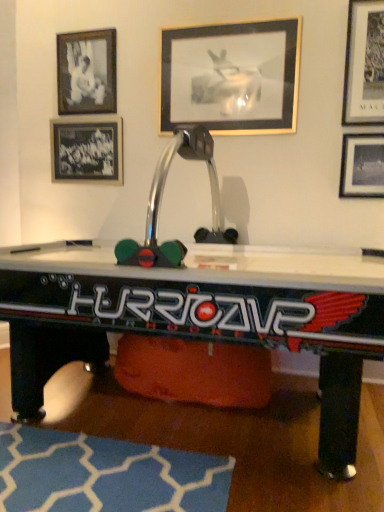
Locate an element on the screen. free spot below metallic silver air hockey table at center (from a real-world perspective) is located at coordinates (232, 426).